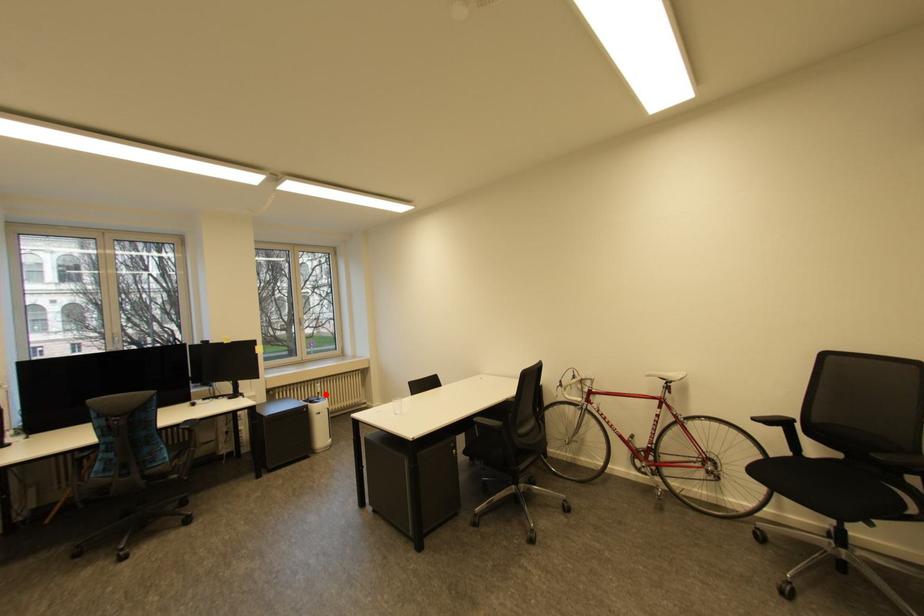
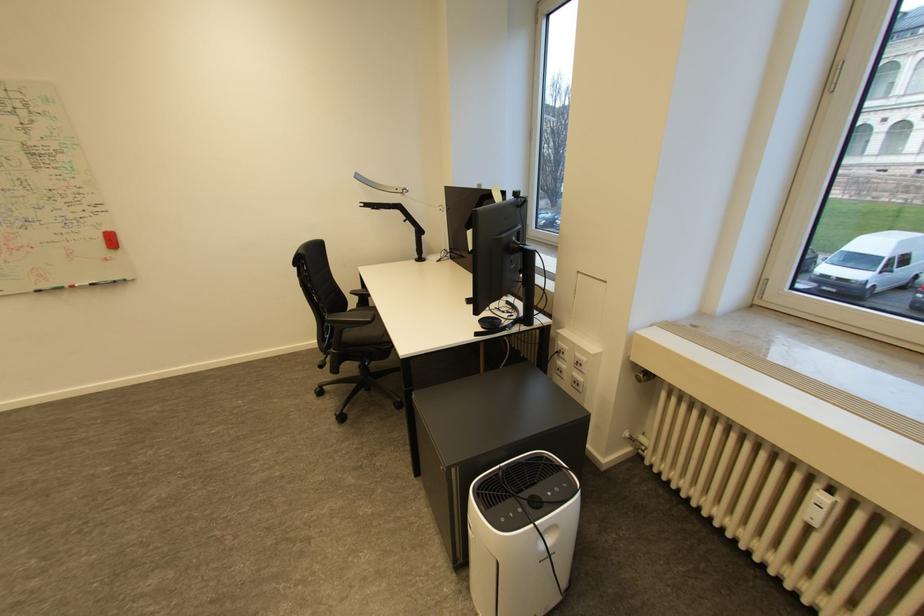
Find the pixel in the second image that matches the highlighted location in the first image.

(816, 525)